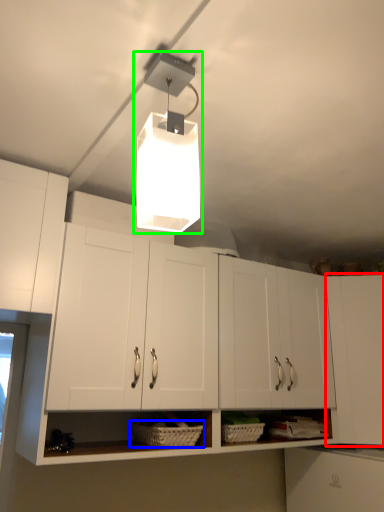
Question: Estimate the real-world distances between objects in this image. Which object is closer to cabinetry (highlighted by a red box), basket (highlighted by a blue box) or lamp (highlighted by a green box)?

Choices:
 (A) basket
 (B) lamp

Answer: (A)